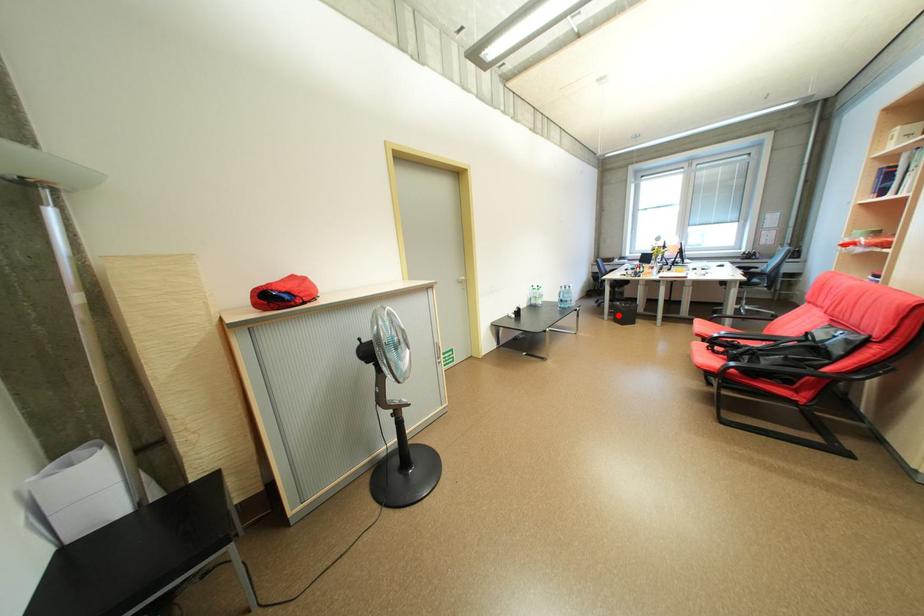
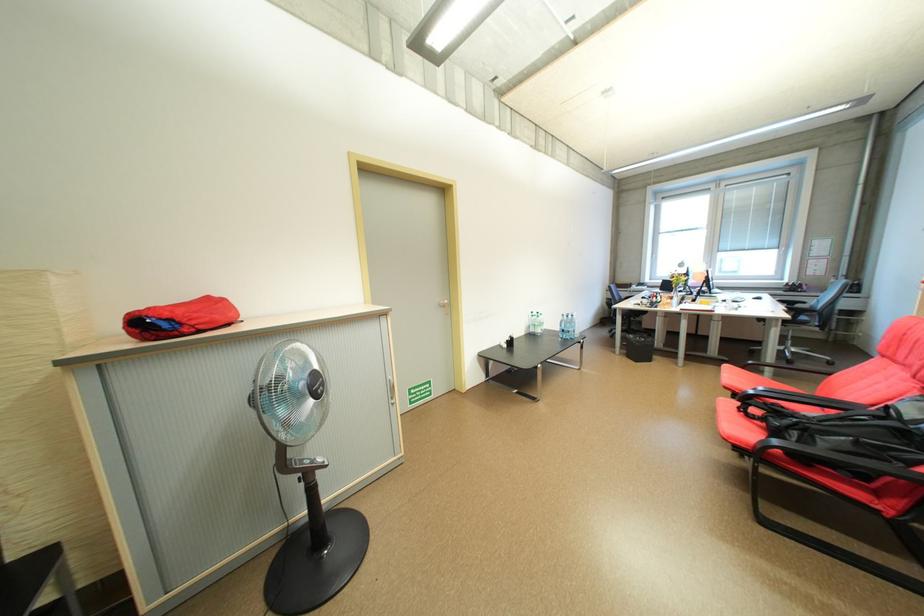
Question: I am providing you with two images of the same scene from different viewpoints. Given a red point in image1, look at the same physical point in image2. Is it:

Choices:
 (A) Closer to the viewpoint
 (B) Farther from the viewpoint

Answer: (A)